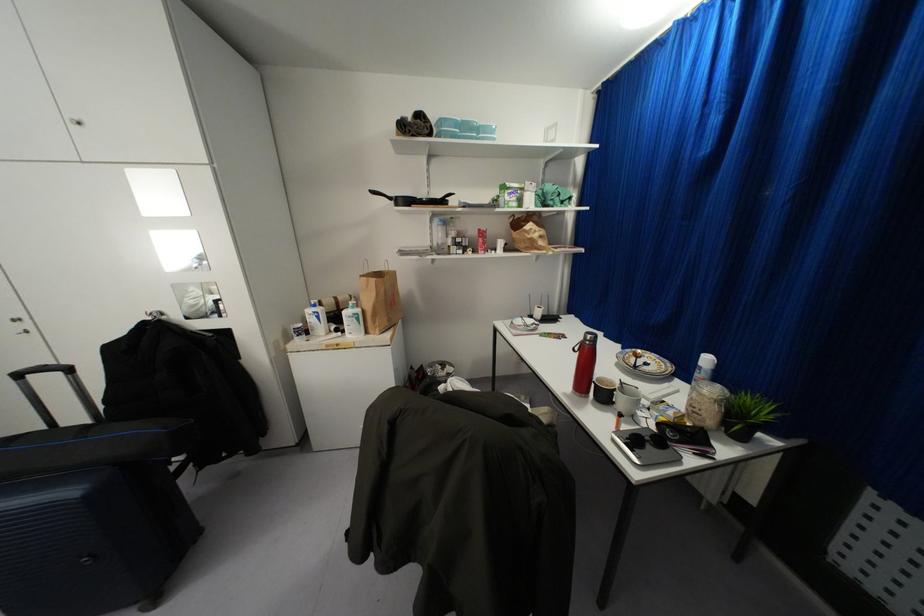
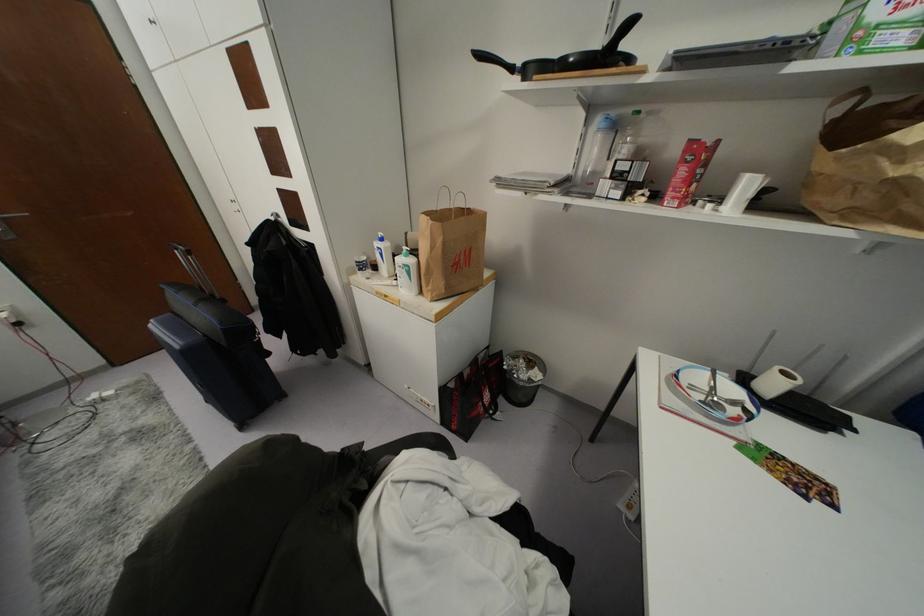
Locate, in the second image, the point that corresponds to [317,315] in the first image.

(381, 254)